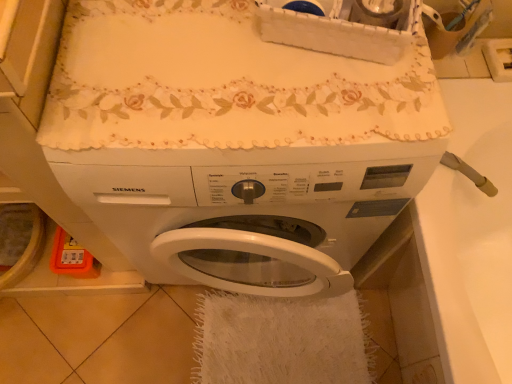
This screenshot has width=512, height=384. I want to click on white fluffy bath towel at lower center, so click(x=280, y=340).

The image size is (512, 384). Describe the element at coordinates (234, 144) in the screenshot. I see `white matte washing machine at center` at that location.

Find the location of a particular element. This screenshot has width=512, height=384. white glossy sink at right is located at coordinates (471, 236).

Does white matte washing machine at center contain white glossy sink at right?

No, white matte washing machine at center does not contain white glossy sink at right.

From the image's perspective, which one is positioned higher, white matte washing machine at center or white glossy sink at right?

From the image's view, white matte washing machine at center is above.

Would you consider white matte washing machine at center to be distant from white glossy sink at right?

white matte washing machine at center is near white glossy sink at right, not far away.

Who is bigger, white matte washing machine at center or white glossy sink at right?

With larger size is white matte washing machine at center.

I want to click on bath towel that appears below the white glossy sink at right (from a real-world perspective), so click(280, 340).

From the image's perspective, which one is positioned higher, white fluffy bath towel at lower center or white glossy sink at right?

white glossy sink at right, from the image's perspective.

Is white fluffy bath towel at lower center closer to camera compared to white glossy sink at right?

No.

Where is `bath towel located behind the white glossy sink at right`? bath towel located behind the white glossy sink at right is located at coordinates (280, 340).

Is white glossy sink at right oriented towards white fluffy bath towel at lower center?

Yes, white glossy sink at right faces towards white fluffy bath towel at lower center.

Are white glossy sink at right and white fluffy bath towel at lower center beside each other?

white glossy sink at right and white fluffy bath towel at lower center are clearly separated.

Can you tell me how much white fluffy bath towel at lower center and white matte washing machine at center differ in facing direction?

white fluffy bath towel at lower center and white matte washing machine at center are facing 90.9 degrees away from each other.

Is white fluffy bath towel at lower center turned away from white matte washing machine at center?

No, white fluffy bath towel at lower center's orientation is not away from white matte washing machine at center.

From the picture: From the image's perspective, between white fluffy bath towel at lower center and white matte washing machine at center, which one is located above?

white matte washing machine at center appears higher in the image.

Is there a large distance between white fluffy bath towel at lower center and white matte washing machine at center?

That's not correct — white fluffy bath towel at lower center is a little close to white matte washing machine at center.

Is white glossy sink at right wider or thinner than white matte washing machine at center?

Considering their sizes, white glossy sink at right looks broader than white matte washing machine at center.

Can you see white glossy sink at right touching white matte washing machine at center?

No, white glossy sink at right is not in contact with white matte washing machine at center.

From the image's perspective, relative to white matte washing machine at center, is white glossy sink at right above or below?

white glossy sink at right is below white matte washing machine at center.

Which object is wider, white matte washing machine at center or white fluffy bath towel at lower center?

white fluffy bath towel at lower center is wider.

Where is `washing machine that is on the left side of white fluffy bath towel at lower center`? washing machine that is on the left side of white fluffy bath towel at lower center is located at coordinates (234, 144).

Is point (428, 130) closer or farther from the camera than point (288, 366)?

Point (428, 130) is positioned closer to the camera compared to point (288, 366).

The width and height of the screenshot is (512, 384). Find the location of `counter top that is on the right side of white matte washing machine at center`. counter top that is on the right side of white matte washing machine at center is located at coordinates (471, 236).

Image resolution: width=512 pixels, height=384 pixels. I want to click on counter top above the white fluffy bath towel at lower center (from the image's perspective), so click(471, 236).

From the image, which object appears to be farther from white glossy sink at right, white matte washing machine at center or white fluffy bath towel at lower center?

white fluffy bath towel at lower center is positioned further to the anchor white glossy sink at right.

From the image, which object appears to be farther from white glossy sink at right, white fluffy bath towel at lower center or white matte washing machine at center?

white fluffy bath towel at lower center lies further to white glossy sink at right than the other object.

Based on their spatial positions, is white glossy sink at right or white fluffy bath towel at lower center further from white matte washing machine at center?

The object further to white matte washing machine at center is white fluffy bath towel at lower center.

Based on their spatial positions, is white fluffy bath towel at lower center or white glossy sink at right further from white matte washing machine at center?

Based on the image, white fluffy bath towel at lower center appears to be further to white matte washing machine at center.

Looking at the image, which one is located further to white fluffy bath towel at lower center, white glossy sink at right or white matte washing machine at center?

white glossy sink at right is further to white fluffy bath towel at lower center.

From the image, which object appears to be farther from white fluffy bath towel at lower center, white matte washing machine at center or white glossy sink at right?

Among the two, white glossy sink at right is located further to white fluffy bath towel at lower center.

Find the location of `bath towel situated between white matte washing machine at center and white glossy sink at right from left to right`. bath towel situated between white matte washing machine at center and white glossy sink at right from left to right is located at coordinates (280, 340).